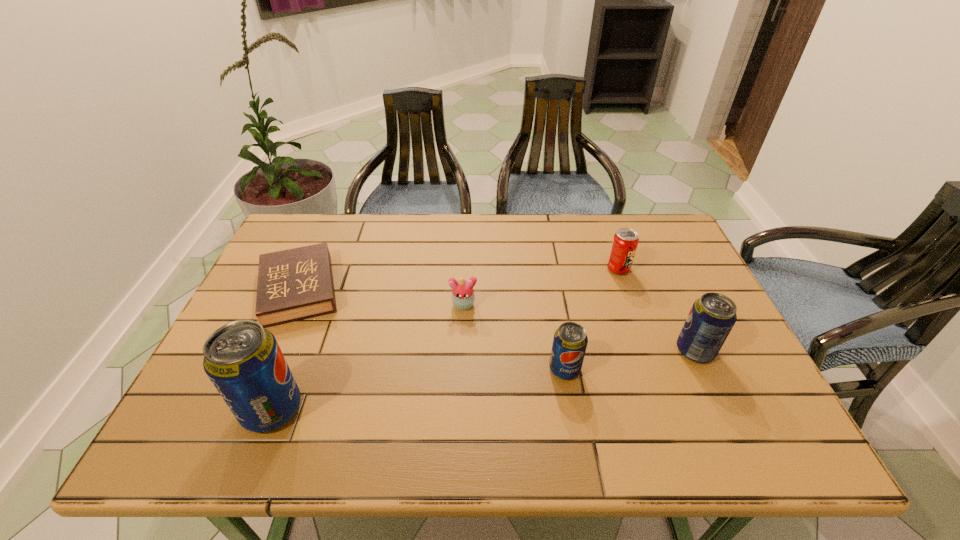
Locate an element on the screen. This screenshot has width=960, height=540. vacant area between the third soda can from left to right and the fourth object from right to left is located at coordinates (540, 287).

The width and height of the screenshot is (960, 540). I want to click on vacant space in between the fifth object from left to right and the hardback book, so click(x=459, y=279).

This screenshot has height=540, width=960. What are the coordinates of `unoccupied area between the rightmost object and the hardback book` in the screenshot? It's located at (497, 320).

Locate an element on the screen. The image size is (960, 540). vacant space that is in between the third soda can from left to right and the third shortest soda can is located at coordinates (657, 310).

At what (x,y) coordinates should I click in order to perform the action: click on free space between the farthest soda can and the rightmost soda can. Please return your answer as a coordinate pair (x, y). The image size is (960, 540). Looking at the image, I should click on (657, 310).

Where is `vacant space in between the second shortest object and the leftmost soda can`? vacant space in between the second shortest object and the leftmost soda can is located at coordinates click(368, 357).

Locate an element on the screen. This screenshot has height=540, width=960. empty location between the cupcake and the farthest soda can is located at coordinates (540, 287).

The height and width of the screenshot is (540, 960). I want to click on free space between the third object from left to right and the hardback book, so click(381, 297).

Find the location of a particular element. the third closest object to the tallest object is located at coordinates (570, 341).

In order to click on the second closest object to the third soda can from right to left in this screenshot , I will do `click(712, 317)`.